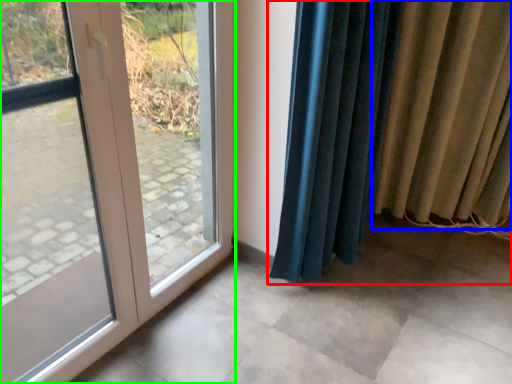
Question: Which object is positioned farthest from curtain (highlighted by a red box)? Select from curtain (highlighted by a blue box) and door (highlighted by a green box).

Choices:
 (A) curtain
 (B) door

Answer: (B)